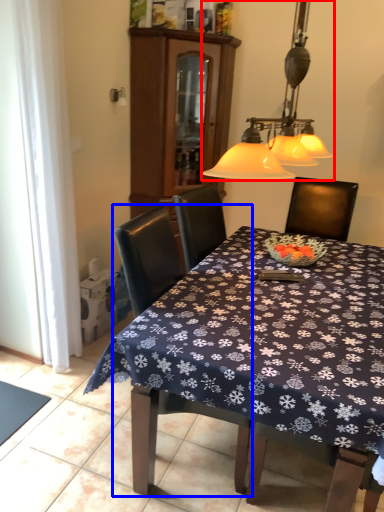
Question: Which object is further to the camera taking this photo, lamp (highlighted by a red box) or chair (highlighted by a blue box)?

Choices:
 (A) lamp
 (B) chair

Answer: (B)